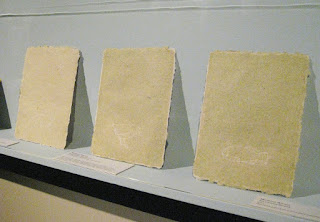
This screenshot has height=222, width=320. I want to click on pale blue shelf, so click(197, 34).